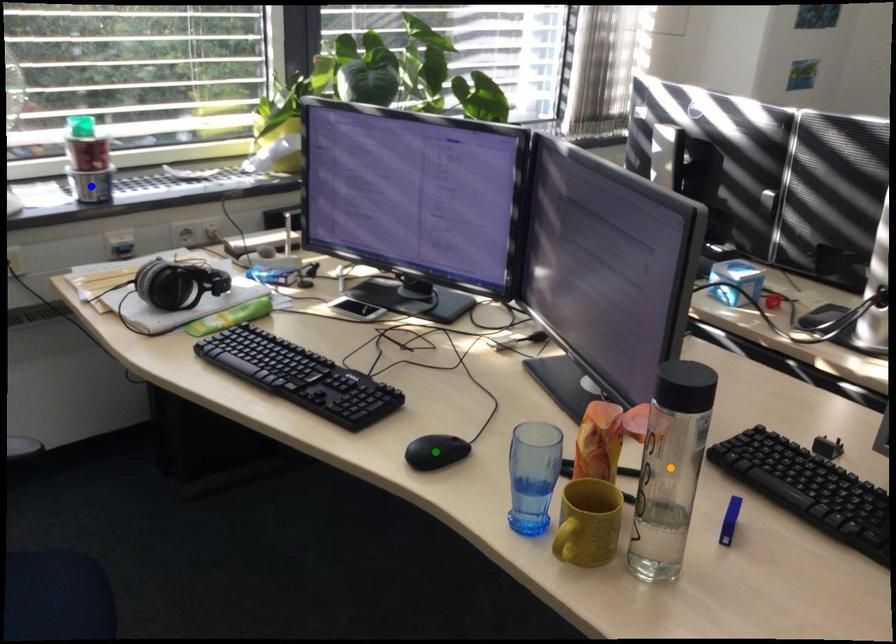
Order these from farthest to nearest:
blue point, orange point, green point

blue point, green point, orange point